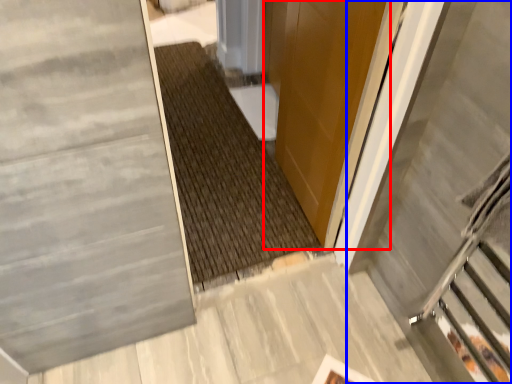
Question: Among these objects, which one is farthest to the camera, door (highlighted by a red box) or escalator (highlighted by a blue box)?

Choices:
 (A) door
 (B) escalator

Answer: (A)